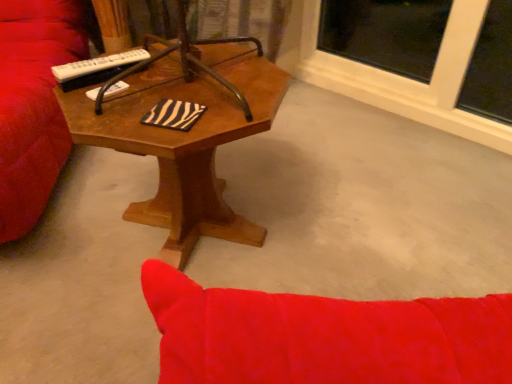
Find the location of a particular element. vacant area that is situated to the right of wooden coffee table at center is located at coordinates (349, 215).